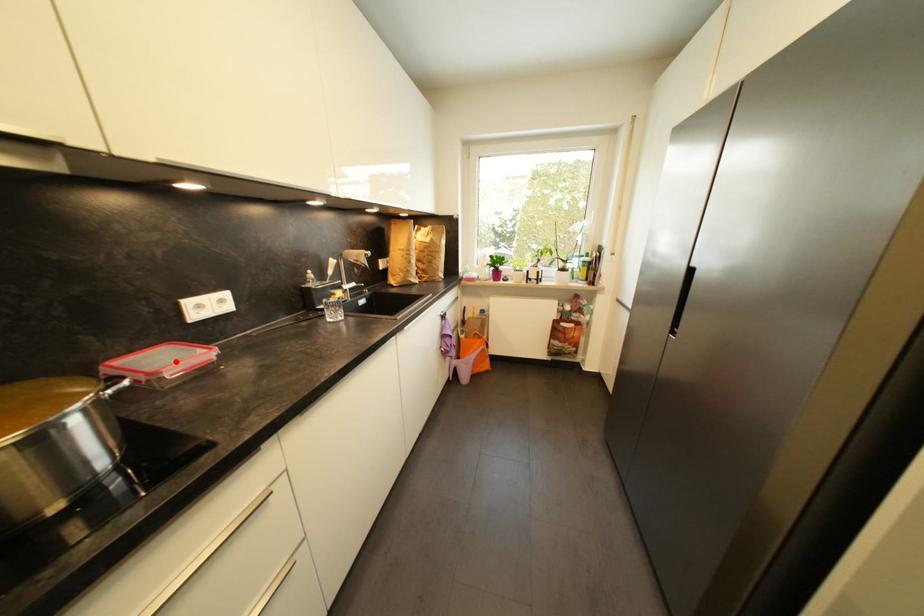
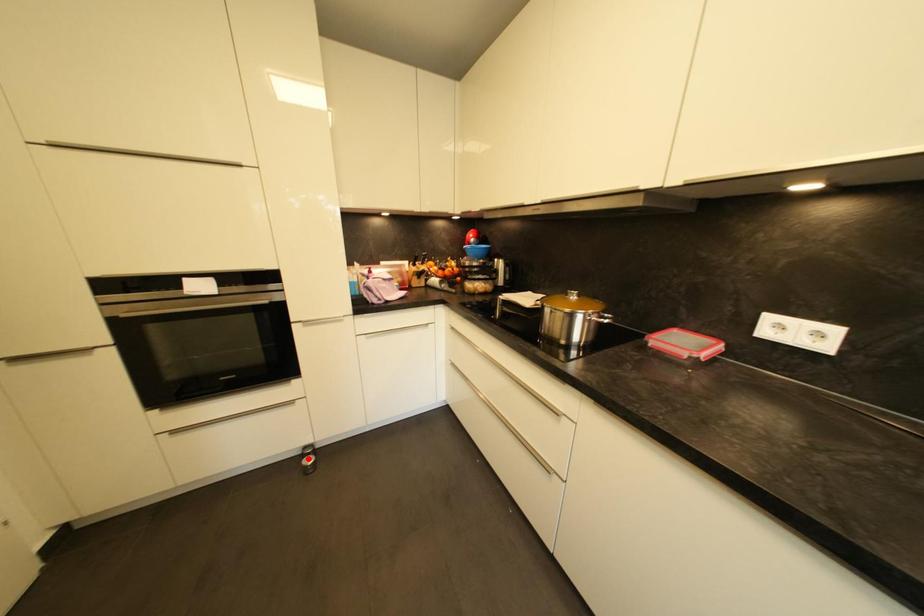
I am providing you with two images of the same scene from different viewpoints. A red point is marked on the first image and another point is marked on the second image. Is the marked point in image1 the same physical position as the marked point in image2?

No